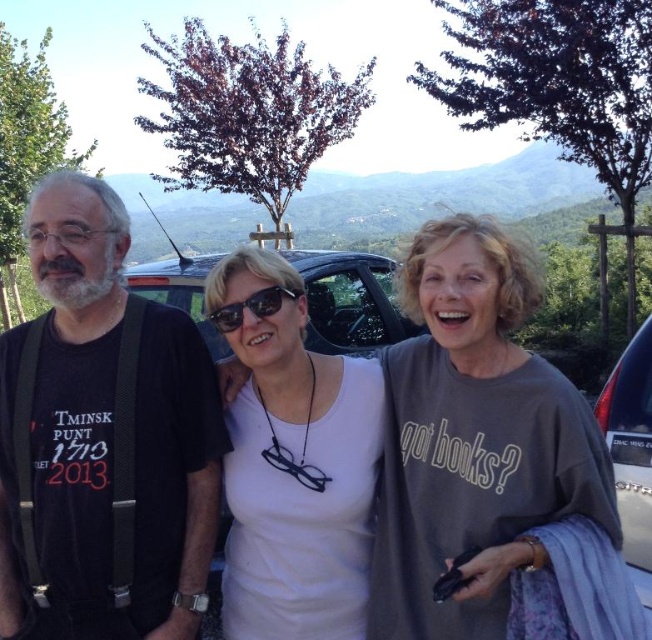
Can you confirm if white matte shirt at center is positioned to the left of sunglasses at center?

Incorrect, white matte shirt at center is not on the left side of sunglasses at center.

Does point (426, 595) lie in front of point (258, 291)?

Yes, point (426, 595) is closer to viewer.

At what (x,y) coordinates should I click in order to perform the action: click on white matte shirt at center. Please return your answer as a coordinate pair (x, y). The height and width of the screenshot is (640, 652). Looking at the image, I should click on (473, 436).

Find the location of `white matte shirt at center`. white matte shirt at center is located at coordinates (473, 436).

Which of these two, white matte shirt at center or white matte tank top at center, stands shorter?

white matte tank top at center

Describe the element at coordinates (473, 436) in the screenshot. Image resolution: width=652 pixels, height=640 pixels. I see `white matte shirt at center` at that location.

Based on the photo, who is more distant from viewer, [441,429] or [299,452]?

Point [299,452]

Where is `white matte shirt at center`? The image size is (652, 640). white matte shirt at center is located at coordinates (473, 436).

Does black matte t-shirt at left appear under sunglasses at center?

Yes.

Between point (38, 284) and point (291, 292), which one is positioned in front?

Point (38, 284) is in front.

What are the coordinates of `black matte t-shirt at left` in the screenshot? It's located at (76, 376).